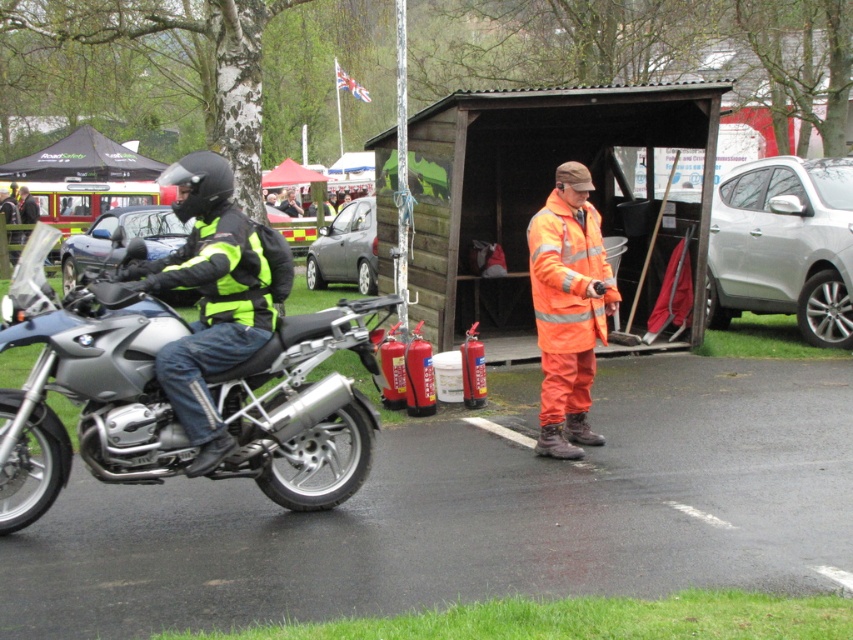
You are standing at the point labeled point (134,221) and want to move to the point labeled point (471,163). Is the destination point in front of or behind your current position?

The destination point labeled point (471,163) is in front of your current position at point (134,221) according to the spatial relationship provided.

You are planning to park your car in the parking lot shown in the image. There is a wooden shed at center and a silver metallic car at center. Which object takes up more space in the parking lot?

The silver metallic car at center occupies more space than the wooden shed at center in the parking lot.

You are a pedestrian standing at the edge of a busy road. You see an orange reflective suit at center and a silver metallic car at center. Which object is closer to you?

The orange reflective suit at center is closer to you because it is positioned further to the viewer than the silver metallic car at center.